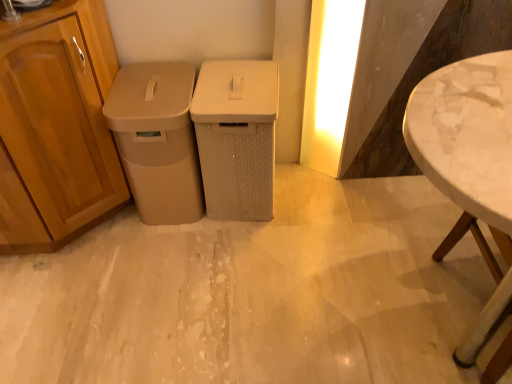
The width and height of the screenshot is (512, 384). I want to click on free space to the left of yellow matte light at upper right, so click(296, 174).